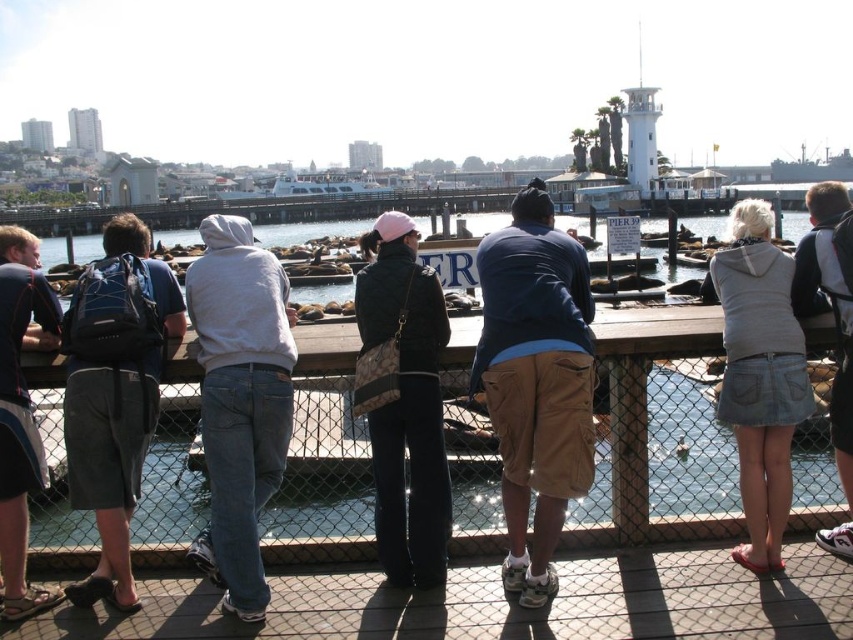
Question: Which object is the farthest from the denim shorts at lower right?

Choices:
 (A) wooden dock at lower center
 (B) brushed metal backpack at left
 (C) dark gray shorts at left

Answer: (B)

Question: Does wooden dock at lower center come in front of brushed metal backpack at left?

Choices:
 (A) no
 (B) yes

Answer: (B)

Question: Can you confirm if wooden dock at lower center is thinner than denim skirt at lower right?

Choices:
 (A) no
 (B) yes

Answer: (A)

Question: From the image, what is the correct spatial relationship of wooden dock at lower center in relation to light gray hoodie at center?

Choices:
 (A) left
 (B) right

Answer: (B)

Question: Considering the real-world distances, which object is farthest from the wooden dock at lower center?

Choices:
 (A) white glossy ferry at upper center
 (B) denim skirt at lower right

Answer: (A)

Question: Which point is farther from the camera taking this photo?

Choices:
 (A) pos(819,282)
 (B) pos(758,496)
 (C) pos(704,627)
 (D) pos(20,454)

Answer: (A)